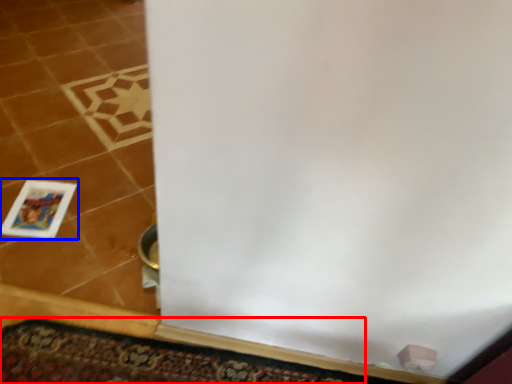
Question: Which object appears closest to the camera in this image, doormat (highlighted by a red box) or picture frame (highlighted by a blue box)?

Choices:
 (A) doormat
 (B) picture frame

Answer: (A)